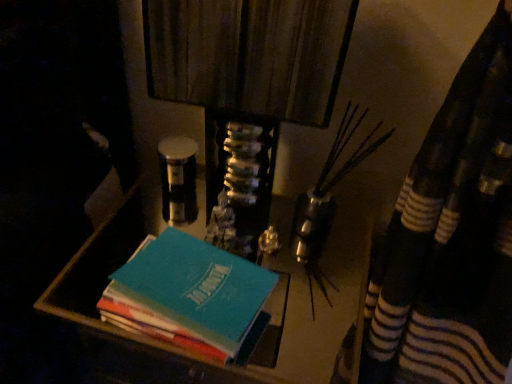
Where is `teal matte book stack at center`? The width and height of the screenshot is (512, 384). teal matte book stack at center is located at coordinates (263, 265).

The image size is (512, 384). What do you see at coordinates (263, 265) in the screenshot?
I see `teal matte book stack at center` at bounding box center [263, 265].

Describe the element at coordinates (188, 294) in the screenshot. I see `teal matte book at center` at that location.

You are a GUI agent. You are given a task and a screenshot of the screen. Output one action in this format:
    pyautogui.click(x=<x>, y=<y>)
    Task: Click on the teal matte book at center
    The width and height of the screenshot is (512, 384).
    Given the screenshot: What is the action you would take?
    pyautogui.click(x=188, y=294)

Locate an element on the screen. teal matte book stack at center is located at coordinates (263, 265).

Which object is positioned more to the left, teal matte book stack at center or teal matte book at center?

teal matte book at center.

Is the position of teal matte book stack at center more distant than that of teal matte book at center?

Yes, it is behind teal matte book at center.

Is point (347, 206) farther from viewer compared to point (100, 307)?

Yes, point (347, 206) is behind point (100, 307).

From the image's perspective, is teal matte book stack at center on teal matte book at center?

No, from the image's perspective, teal matte book stack at center is not over teal matte book at center.

Based on the photo, from a real-world perspective, which is physically above, teal matte book stack at center or teal matte book at center?

teal matte book at center, from a real-world perspective.

Is teal matte book stack at center wider than teal matte book at center?

Indeed, teal matte book stack at center has a greater width compared to teal matte book at center.

Considering the sizes of objects teal matte book stack at center and teal matte book at center in the image provided, who is taller, teal matte book stack at center or teal matte book at center?

With more height is teal matte book stack at center.

Which of these two, teal matte book stack at center or teal matte book at center, is smaller?

teal matte book at center.

Is teal matte book stack at center situated inside teal matte book at center or outside?

teal matte book stack at center is not enclosed by teal matte book at center.

Is teal matte book stack at center touching teal matte book at center?

No, teal matte book stack at center is not touching teal matte book at center.

Could you tell me if teal matte book stack at center is facing teal matte book at center?

No, teal matte book stack at center does not turn towards teal matte book at center.

What's the angular difference between teal matte book stack at center and teal matte book at center's facing directions?

The facing directions of teal matte book stack at center and teal matte book at center are 5.1 degrees apart.

Based on the photo, measure the distance from teal matte book stack at center to teal matte book at center.

The distance of teal matte book stack at center from teal matte book at center is 11.49 inches.

Image resolution: width=512 pixels, height=384 pixels. In order to click on vanity that is behind the teal matte book at center in this screenshot , I will do `click(263, 265)`.

Between teal matte book at center and teal matte book stack at center, which one appears on the left side from the viewer's perspective?

teal matte book at center.

Who is more distant, teal matte book at center or teal matte book stack at center?

teal matte book stack at center is further from the camera.

Which is farther from the camera, (x=139, y=270) or (x=42, y=296)?

The point (x=42, y=296) is more distant.

From the image's perspective, between teal matte book at center and teal matte book stack at center, which one is located above?

teal matte book at center is shown above in the image.

Looking at this image, from a real-world perspective, which object stands above the other?

teal matte book at center is physically above.

Between teal matte book at center and teal matte book stack at center, which one has larger width?

teal matte book stack at center.

Which of these two, teal matte book at center or teal matte book stack at center, stands shorter?

teal matte book at center is shorter.

Considering the sizes of objects teal matte book at center and teal matte book stack at center in the image provided, who is smaller, teal matte book at center or teal matte book stack at center?

teal matte book at center is smaller.

Is teal matte book at center outside of teal matte book stack at center?

Yes, teal matte book at center is not within teal matte book stack at center.

Is teal matte book at center placed right next to teal matte book stack at center?

No, teal matte book at center is not in contact with teal matte book stack at center.

Is teal matte book at center looking in the opposite direction of teal matte book stack at center?

teal matte book at center is not turned away from teal matte book stack at center.

I want to click on vanity behind the teal matte book at center, so click(263, 265).

At what (x,y) coordinates should I click in order to perform the action: click on vanity below the teal matte book at center (from the image's perspective). Please return your answer as a coordinate pair (x, y). The height and width of the screenshot is (384, 512). Looking at the image, I should click on (263, 265).

Find the location of a particular element. vanity below the teal matte book at center (from a real-world perspective) is located at coordinates (263, 265).